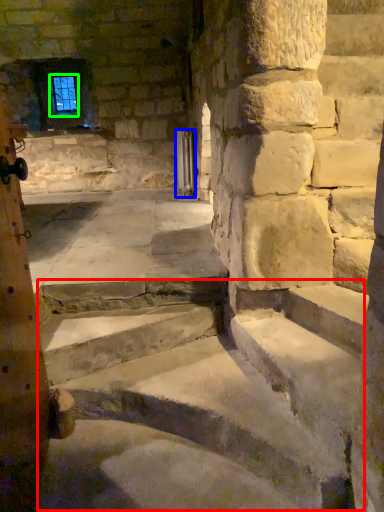
Question: Which is nearer to the stairwell (highlighted by a red box)? door (highlighted by a blue box) or window screen (highlighted by a green box).

Choices:
 (A) door
 (B) window screen

Answer: (A)